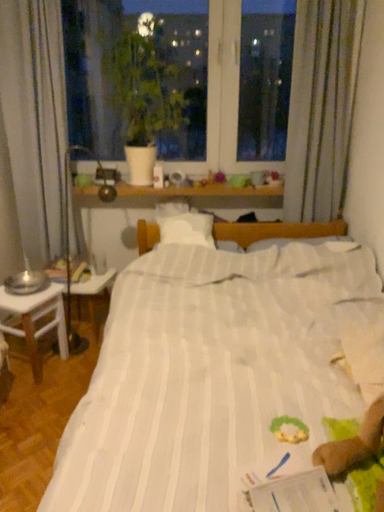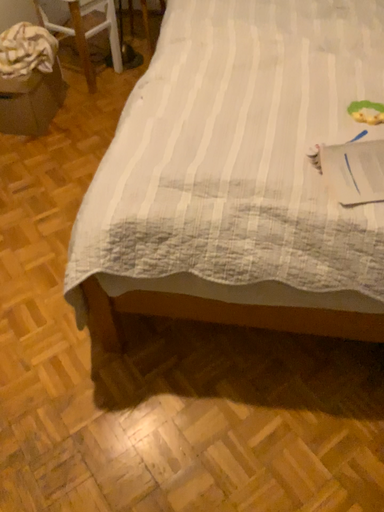
Question: How did the camera likely rotate when shooting the video?

Choices:
 (A) rotated downward
 (B) rotated upward

Answer: (A)